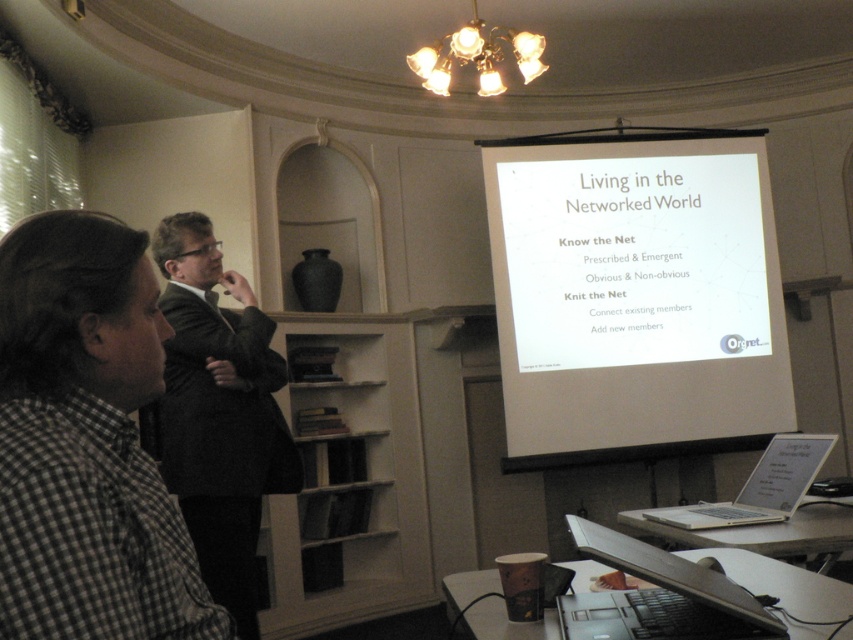
Who is more distant from viewer, [672,428] or [769,456]?

Point [672,428]

Which is in front, point (706, 426) or point (767, 502)?

Point (767, 502) is more forward.

Locate an element on the screen. The image size is (853, 640). white paper at center is located at coordinates (635, 296).

Does point (193, 561) come farther from viewer compared to point (207, 401)?

No, (193, 561) is in front of (207, 401).

Which is more to the right, checkered fabric shirt at left or dark gray suit at left?

From the viewer's perspective, checkered fabric shirt at left appears more on the right side.

Identify the location of checkered fabric shirt at left. (86, 444).

Is the position of white paper at center more distant than that of checkered fabric shirt at left?

Yes, white paper at center is behind checkered fabric shirt at left.

Between white paper at center and checkered fabric shirt at left, which one has more height?

Standing taller between the two is white paper at center.

Is point (730, 248) more distant than point (177, 589)?

That is True.

What are the coordinates of `white paper at center` in the screenshot? It's located at pos(635,296).